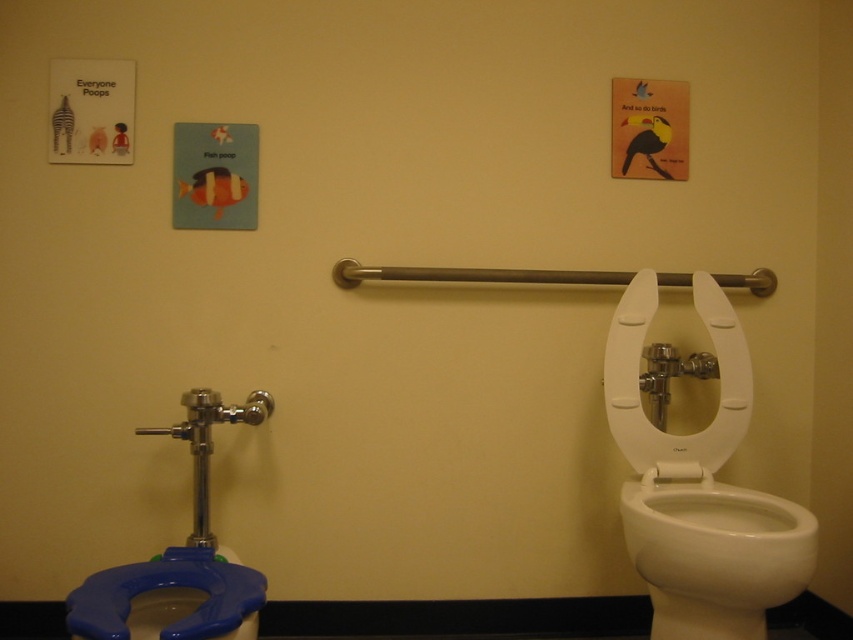
I want to click on white plastic toilet seat at right, so click(637, 372).

Which is more to the left, white plastic toilet seat at right or white matte toilet paper at upper center?

white matte toilet paper at upper center is more to the left.

Is point (613, 384) closer to viewer compared to point (669, 465)?

Yes, it is.

Identify the location of white plastic toilet seat at right. Image resolution: width=853 pixels, height=640 pixels. (637, 372).

Does white plastic toilet seat at right have a lesser width compared to blue plastic toilet paper at lower left?

No.

I want to click on white plastic toilet seat at right, so click(637, 372).

Is point (161, 598) positioned behind point (686, 476)?

No, (161, 598) is closer to viewer.

Is the position of blue plastic toilet seat at lower left less distant than that of white matte toilet paper at upper center?

That is True.

Where is `blue plastic toilet seat at lower left`? The width and height of the screenshot is (853, 640). blue plastic toilet seat at lower left is located at coordinates coord(167,600).

Where is `blue plastic toilet seat at lower left`? The image size is (853, 640). blue plastic toilet seat at lower left is located at coordinates (167, 600).